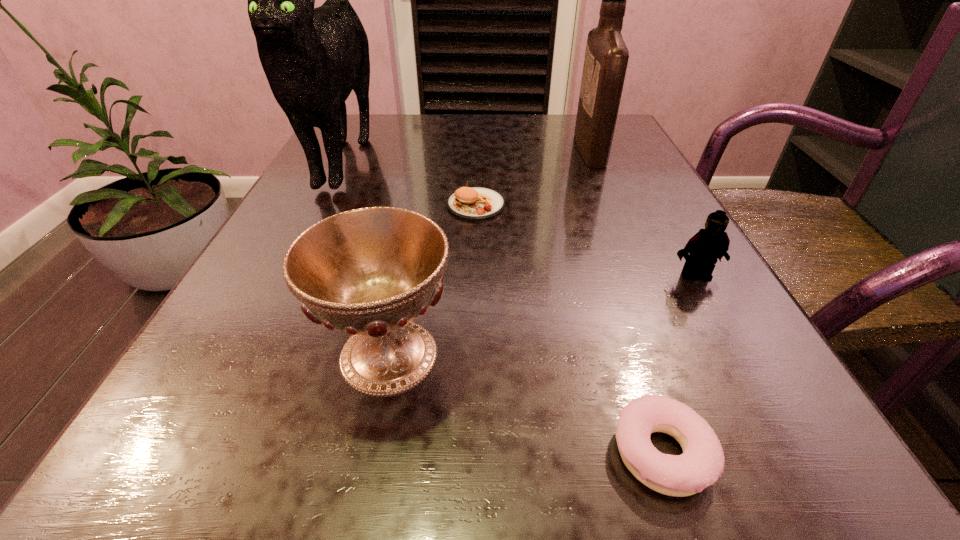
Identify the location of empty space between the chalice and the second tallest object. (490, 252).

The width and height of the screenshot is (960, 540). In order to click on vacant space that is in between the fourth farthest object and the liquor in this screenshot , I will do `click(642, 212)`.

Identify the location of free point between the fourth farthest object and the second tallest object. The height and width of the screenshot is (540, 960). (642, 212).

Identify the location of vacant space that's between the doughnut and the liquor. (626, 300).

At what (x,y) coordinates should I click in order to perform the action: click on object that is the closest to the fourth farthest object. Please return your answer as a coordinate pair (x, y). This screenshot has width=960, height=540. Looking at the image, I should click on (701, 464).

You are a GUI agent. You are given a task and a screenshot of the screen. Output one action in this format:
    pyautogui.click(x=<x>, y=<y>)
    Task: Click on the object that is the closest to the doughnut
    This screenshot has width=960, height=540.
    Given the screenshot: What is the action you would take?
    pyautogui.click(x=370, y=272)

Where is `free spot that satisfies the following two spatial constraints: 1. on the face of the fifth tallest object; 2. on the left side of the leftmost object`? The image size is (960, 540). free spot that satisfies the following two spatial constraints: 1. on the face of the fifth tallest object; 2. on the left side of the leftmost object is located at coordinates (322, 205).

Locate an element on the screen. Image resolution: width=960 pixels, height=540 pixels. vacant point that satisfies the following two spatial constraints: 1. on the label side of the fifth shortest object; 2. on the front side of the fourth shortest object is located at coordinates (678, 355).

Locate an element on the screen. This screenshot has height=540, width=960. free location that satisfies the following two spatial constraints: 1. on the label side of the liquor; 2. on the face of the tallest object is located at coordinates (592, 155).